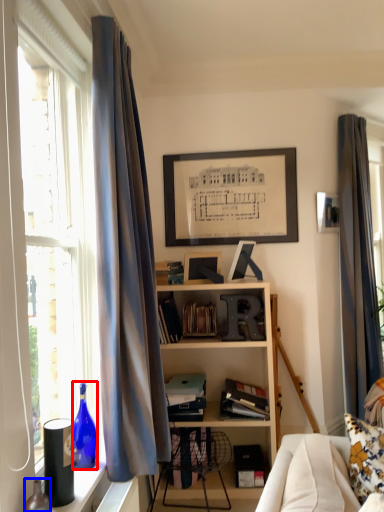
Question: Which object is further to the camera taking this photo, bottle (highlighted by a red box) or bottle (highlighted by a blue box)?

Choices:
 (A) bottle
 (B) bottle

Answer: (A)